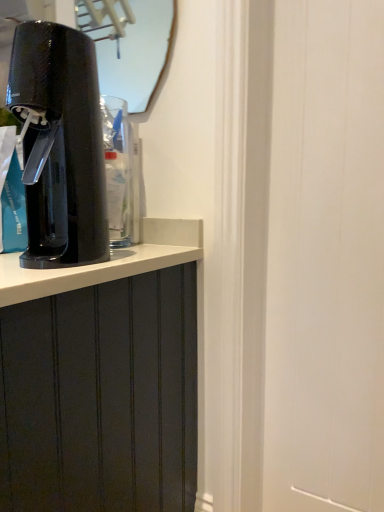
Question: Should I look upward or downward to see transparent plastic water cooler at left?

Choices:
 (A) down
 (B) up

Answer: (B)

Question: Is matte glass mirror at upper center smaller than transparent plastic water cooler at left?

Choices:
 (A) no
 (B) yes

Answer: (B)

Question: Can you confirm if matte glass mirror at upper center is taller than transparent plastic water cooler at left?

Choices:
 (A) yes
 (B) no

Answer: (B)

Question: Is matte glass mirror at upper center not within transparent plastic water cooler at left?

Choices:
 (A) no
 (B) yes

Answer: (B)

Question: Is matte glass mirror at upper center to the right of transparent plastic water cooler at left from the viewer's perspective?

Choices:
 (A) no
 (B) yes

Answer: (B)

Question: Is matte glass mirror at upper center surrounding transparent plastic water cooler at left?

Choices:
 (A) yes
 (B) no

Answer: (B)

Question: From the image's perspective, is matte glass mirror at upper center beneath transparent plastic water cooler at left?

Choices:
 (A) yes
 (B) no

Answer: (B)

Question: Can you confirm if black glossy soda maker at left is taller than transparent plastic water cooler at left?

Choices:
 (A) yes
 (B) no

Answer: (A)

Question: Can you confirm if black glossy soda maker at left is shorter than transparent plastic water cooler at left?

Choices:
 (A) yes
 (B) no

Answer: (B)

Question: Considering the relative positions of black glossy soda maker at left and transparent plastic water cooler at left in the image provided, is black glossy soda maker at left to the right of transparent plastic water cooler at left from the viewer's perspective?

Choices:
 (A) no
 (B) yes

Answer: (A)

Question: From a real-world perspective, does black glossy soda maker at left stand above transparent plastic water cooler at left?

Choices:
 (A) yes
 (B) no

Answer: (A)

Question: Considering the relative positions of black glossy soda maker at left and transparent plastic water cooler at left in the image provided, is black glossy soda maker at left behind transparent plastic water cooler at left?

Choices:
 (A) yes
 (B) no

Answer: (B)

Question: Is black glossy soda maker at left with transparent plastic water cooler at left?

Choices:
 (A) yes
 (B) no

Answer: (B)

Question: Does transparent plastic water cooler at left have a larger size compared to matte glass mirror at upper center?

Choices:
 (A) yes
 (B) no

Answer: (A)